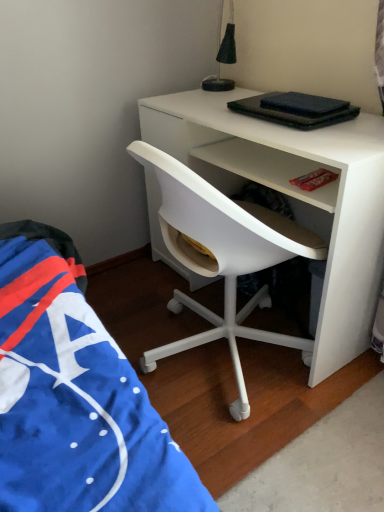
Question: From a real-world perspective, is white plastic chair at center above or below black fabric lampshade at upper center?

Choices:
 (A) below
 (B) above

Answer: (A)

Question: Looking at the image, does white plastic chair at center seem bigger or smaller compared to black fabric lampshade at upper center?

Choices:
 (A) big
 (B) small

Answer: (A)

Question: Considering the positions of point (195, 343) and point (211, 80), is point (195, 343) closer or farther from the camera than point (211, 80)?

Choices:
 (A) closer
 (B) farther

Answer: (A)

Question: Considering the positions of black fabric lampshade at upper center and white plastic chair at center in the image, is black fabric lampshade at upper center bigger or smaller than white plastic chair at center?

Choices:
 (A) small
 (B) big

Answer: (A)

Question: Would you say black fabric lampshade at upper center is to the left or to the right of white plastic chair at center in the picture?

Choices:
 (A) right
 (B) left

Answer: (B)

Question: From their relative heights in the image, would you say black fabric lampshade at upper center is taller or shorter than white plastic chair at center?

Choices:
 (A) tall
 (B) short

Answer: (B)

Question: Is black fabric lampshade at upper center inside the boundaries of white plastic chair at center, or outside?

Choices:
 (A) outside
 (B) inside

Answer: (A)